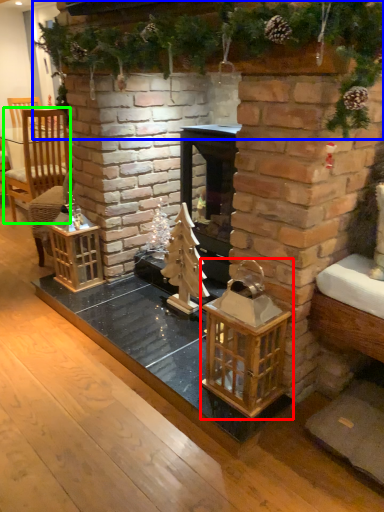
Question: Based on their relative distances, which object is farther from cage (highlighted by a red box)? Choose from christmas decoration (highlighted by a blue box) and armchair (highlighted by a green box).

Choices:
 (A) christmas decoration
 (B) armchair

Answer: (B)